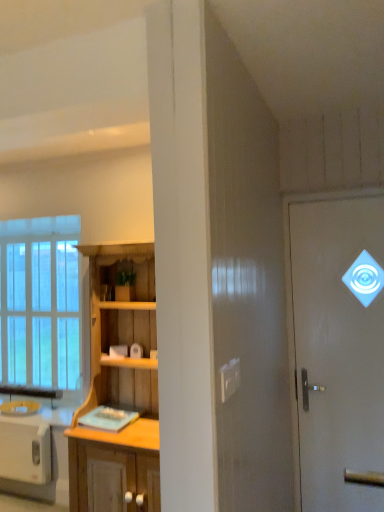
Question: Is white glossy door at upper right taller or shorter than wooden cabinet at center?

Choices:
 (A) tall
 (B) short

Answer: (A)

Question: Would you say white glossy door at upper right is inside or outside wooden cabinet at center?

Choices:
 (A) inside
 (B) outside

Answer: (B)

Question: Based on their relative distances, which object is farther from the wooden cabinet at center?

Choices:
 (A) white glossy door at upper right
 (B) white glossy toaster at lower left
 (C) clear glass window at left

Answer: (C)

Question: Which of these objects is positioned farthest from the white glossy toaster at lower left?

Choices:
 (A) white glossy door at upper right
 (B) clear glass window at left
 (C) wooden cabinet at center

Answer: (A)